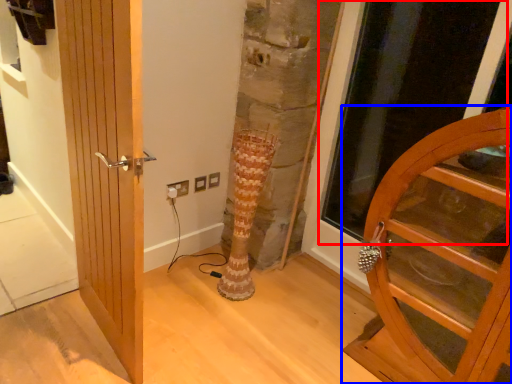
Question: Which object is closer to the camera taking this photo, glass door (highlighted by a red box) or door (highlighted by a blue box)?

Choices:
 (A) glass door
 (B) door

Answer: (B)